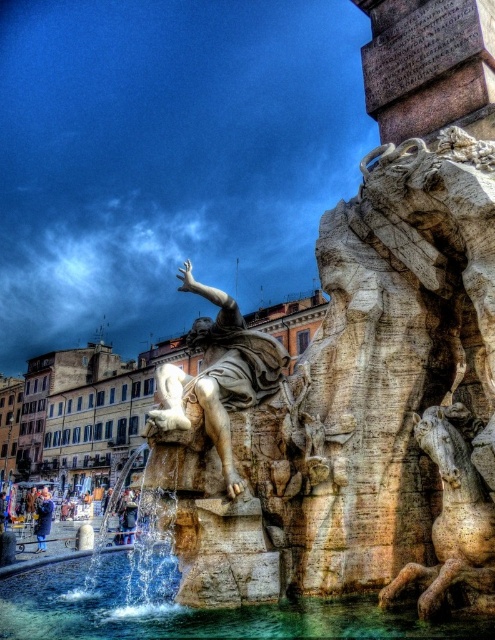
You are standing in the historic square and notice two statues at the center of the fountain. The first is labeled as the stone statue at center, and the second is the white marble statue at center. From your vantage point, which statue is positioned to the left?

The stone statue at center is positioned to the left of the white marble statue at center.

You are standing in the historic square and want to take a photo of the stone statue at center. If you move 0.1 units to the right along the x axis, will you be closer to the statue?

The stone statue at center is located at point (166, 157). Moving 0.1 units to the right along the x axis would increase your x coordinate, so you would be further away from the statue since it is at 0.247 in the x direction.

You are a tourist standing in front of the fountain. You want to take a photo of the stone statue at center and the clear water at fountain center. Which object will appear closer to you in the photo?

The stone statue at center will appear closer in the photo because it is positioned further to the viewer than the clear water at fountain center.